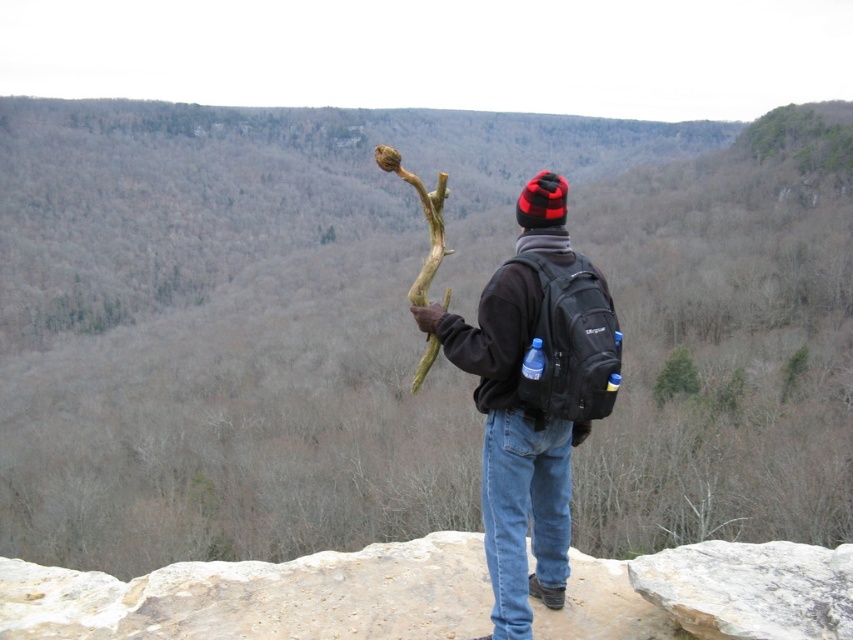
Question: Among these points, which one is nearest to the camera?

Choices:
 (A) (413, 378)
 (B) (502, 401)

Answer: (B)

Question: Is black matte jacket at center thinner than black fleece jacket at center?

Choices:
 (A) no
 (B) yes

Answer: (A)

Question: Is black matte jacket at center smaller than black fleece jacket at center?

Choices:
 (A) yes
 (B) no

Answer: (B)

Question: Does black fleece jacket at center have a lesser width compared to brown rough branch at center?

Choices:
 (A) no
 (B) yes

Answer: (B)

Question: Which point is farther to the camera?

Choices:
 (A) black matte jacket at center
 (B) brown rough branch at center

Answer: (B)

Question: Which point is closer to the camera?

Choices:
 (A) (483, 339)
 (B) (438, 253)

Answer: (A)